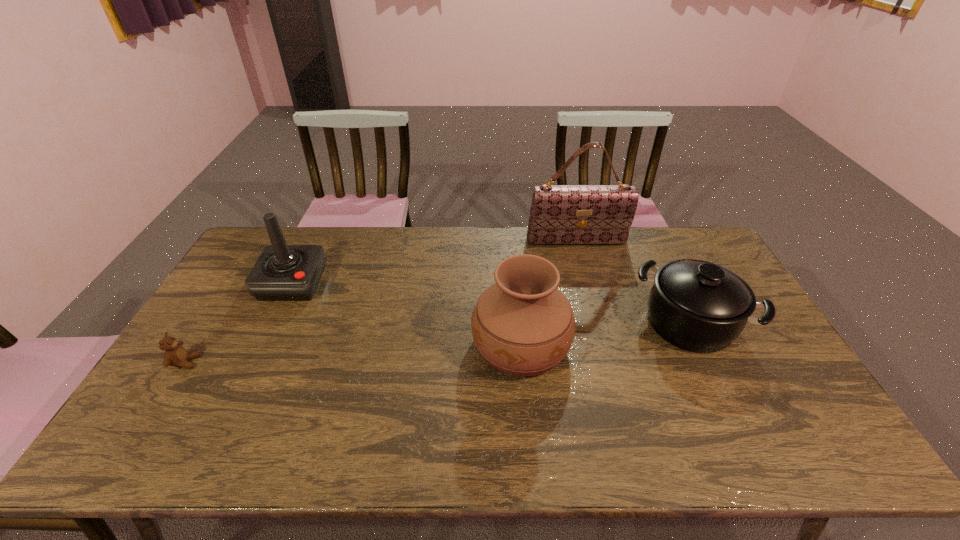
You are a GUI agent. You are given a task and a screenshot of the screen. Output one action in this format:
    pyautogui.click(x=<x>, y=<y>)
    Task: Click on the tallest object
    
    Given the screenshot: What is the action you would take?
    pyautogui.click(x=560, y=214)

At what (x,y) coordinates should I click in order to perform the action: click on the farthest object. Please return your answer as a coordinate pair (x, y). The image size is (960, 540). Looking at the image, I should click on (560, 214).

Image resolution: width=960 pixels, height=540 pixels. I want to click on joystick, so click(x=282, y=272).

Locate an element on the screen. The height and width of the screenshot is (540, 960). urn is located at coordinates click(x=522, y=325).

Image resolution: width=960 pixels, height=540 pixels. Find the location of `saucepan`. saucepan is located at coordinates (698, 306).

Where is `the leftmost object`? the leftmost object is located at coordinates (175, 355).

Find the location of a particular element. The width and height of the screenshot is (960, 540). the shortest object is located at coordinates [x=175, y=355].

Where is `free space located 0.300m on the front of the tallest object with the clasp`? The image size is (960, 540). free space located 0.300m on the front of the tallest object with the clasp is located at coordinates (594, 307).

I want to click on blank space located 0.260m on the front-facing side of the second object from left to right, so click(251, 372).

The image size is (960, 540). Identify the location of vacant area located on the back of the urn. (515, 277).